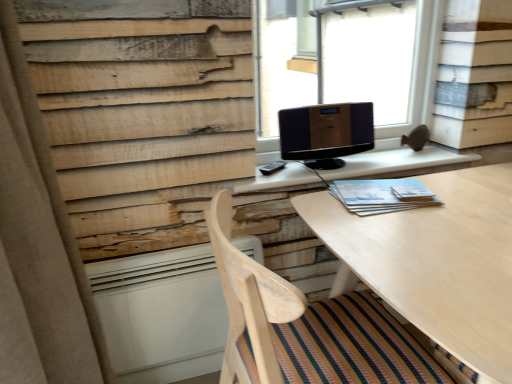
Where is `wooden chair at lower center`? wooden chair at lower center is located at coordinates (307, 327).

Find the location of a particular element. matte wooden table at center is located at coordinates (395, 162).

Image resolution: width=512 pixels, height=384 pixels. I want to click on shiny black monitor at center, so click(326, 133).

The width and height of the screenshot is (512, 384). Find the location of `beige fabric curtain at left`. beige fabric curtain at left is located at coordinates (42, 230).

Looking at this image, considering the positions of objects beige fabric curtain at left and transparent glass speaker at upper center in the image provided, who is more to the right, beige fabric curtain at left or transparent glass speaker at upper center?

Answer: transparent glass speaker at upper center is more to the right.

At what (x,y) coordinates should I click in order to perform the action: click on window that is above the beige fabric curtain at left (from a real-world perspective). Please return your answer as a coordinate pair (x, y). The height and width of the screenshot is (384, 512). Looking at the image, I should click on (348, 62).

From a real-world perspective, which is physically below, beige fabric curtain at left or transparent glass speaker at upper center?

beige fabric curtain at left, from a real-world perspective.

How different are the orientations of beige fabric curtain at left and transparent glass speaker at upper center in degrees?

82.6 degrees.

Does point (77, 316) come closer to viewer compared to point (372, 188)?

That is True.

Can you tell me how much beige fabric curtain at left and light blue paper at right differ in facing direction?

There is a 91.3-degree angle between the facing directions of beige fabric curtain at left and light blue paper at right.

Is beige fabric curtain at left not near light blue paper at right?

They are positioned close to each other.

Is beige fabric curtain at left turned away from light blue paper at right?

beige fabric curtain at left is not turned away from light blue paper at right.

Which of these two, shiny black monitor at center or matte wooden table at center, is bigger?

Bigger between the two is matte wooden table at center.

Could you tell me if shiny black monitor at center is facing matte wooden table at center?

No, shiny black monitor at center is not oriented towards matte wooden table at center.

Looking at this image, from a real-world perspective, is shiny black monitor at center below matte wooden table at center?

Actually, shiny black monitor at center is physically above matte wooden table at center in the real world.

How different are the orientations of shiny black monitor at center and matte wooden table at center in degrees?

2.84 degrees.

From the image's perspective, which one is positioned higher, white matte radiator at lower left or wooden chair at lower center?

white matte radiator at lower left, from the image's perspective.

Between white matte radiator at lower left and wooden chair at lower center, which one has larger size?

Bigger between the two is wooden chair at lower center.

Based on the photo, from a real-world perspective, does white matte radiator at lower left stand above wooden chair at lower center?

Incorrect, from a real-world perspective, white matte radiator at lower left is lower than wooden chair at lower center.

Is wooden chair at lower center surrounded by white matte radiator at lower left?

No, white matte radiator at lower left does not contain wooden chair at lower center.

The width and height of the screenshot is (512, 384). In the image, there is a transparent glass speaker at upper center. Identify the location of radiator below it (from a real-world perspective). (161, 314).

Which is more to the right, transparent glass speaker at upper center or white matte radiator at lower left?

transparent glass speaker at upper center is more to the right.

From the image's perspective, which object appears higher, transparent glass speaker at upper center or white matte radiator at lower left?

transparent glass speaker at upper center is shown above in the image.

Between light blue paper at right and transparent glass speaker at upper center, which one has less height?

light blue paper at right is shorter.

From the image's perspective, which object appears higher, light blue paper at right or transparent glass speaker at upper center?

From the image's view, transparent glass speaker at upper center is above.

Between point (384, 181) and point (431, 72), which one is positioned in front?

The point (384, 181) is closer to the camera.

From a real-world perspective, which object stands above the other?

From a 3D spatial view, transparent glass speaker at upper center is above.

Are transparent glass speaker at upper center and light wood table at center beside each other?

No, transparent glass speaker at upper center is not making contact with light wood table at center.

From a real-world perspective, which object stands above the other?

transparent glass speaker at upper center is physically above.

Considering the relative sizes of transparent glass speaker at upper center and light wood table at center in the image provided, is transparent glass speaker at upper center shorter than light wood table at center?

Correct, transparent glass speaker at upper center is not as tall as light wood table at center.

Who is more distant, transparent glass speaker at upper center or light wood table at center?

transparent glass speaker at upper center is further from the camera.

This screenshot has height=384, width=512. Identify the location of curtain below the transparent glass speaker at upper center (from a real-world perspective). (42, 230).

I want to click on curtain in front of the light blue paper at right, so click(x=42, y=230).

Based on their spatial positions, is beige fabric curtain at left or light wood table at center further from transparent glass speaker at upper center?

beige fabric curtain at left is positioned further to the anchor transparent glass speaker at upper center.

From the image, which object appears to be nearer to matte wooden table at center, wooden chair at lower center or transparent glass speaker at upper center?

wooden chair at lower center.

From the image, which object appears to be farther from light blue paper at right, light wood table at center or white matte radiator at lower left?

white matte radiator at lower left is further to light blue paper at right.

From the image, which object appears to be nearer to light wood table at center, light blue paper at right or matte wooden table at center?

light blue paper at right is closer to light wood table at center.

Looking at the image, which one is located closer to shiny black monitor at center, light blue paper at right or white matte radiator at lower left?

The object closer to shiny black monitor at center is light blue paper at right.

Estimate the real-world distances between objects in this image. Which object is further from light wood table at center, white matte radiator at lower left or shiny black monitor at center?

white matte radiator at lower left is further to light wood table at center.

Based on the photo, based on their spatial positions, is beige fabric curtain at left or light blue paper at right closer to shiny black monitor at center?

light blue paper at right.

Based on the photo, based on their spatial positions, is white matte radiator at lower left or wooden chair at lower center closer to light wood table at center?

wooden chair at lower center.

You are a GUI agent. You are given a task and a screenshot of the screen. Output one action in this format:
    pyautogui.click(x=<x>, y=<y>)
    Task: Click on the computer monitor between transparent glass speaker at upper center and white matte radiator at lower left in the vertical direction
    This screenshot has width=512, height=384.
    Given the screenshot: What is the action you would take?
    pyautogui.click(x=326, y=133)

Locate an element on the screen. This screenshot has height=384, width=512. radiator between beige fabric curtain at left and light blue paper at right in the horizontal direction is located at coordinates (161, 314).

The height and width of the screenshot is (384, 512). Identify the location of radiator located between wooden chair at lower center and shiny black monitor at center in the depth direction. (161, 314).

The image size is (512, 384). I want to click on book between wooden chair at lower center and matte wooden table at center along the z-axis, so click(383, 195).